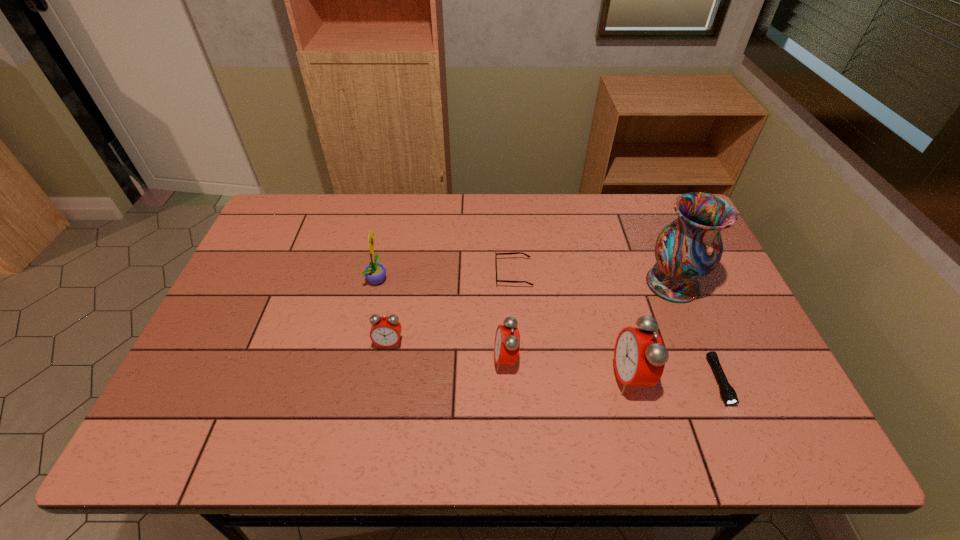
All alarm clocks are currently evenly spaced. To continue this pattern, where would you add another alarm clock on the right? Please point out a vacant spot. Please provide its 2D coordinates. Your answer should be formatted as a tuple, i.e. [(x, y)], where the tuple contains the x and y coordinates of a point satisfying the conditions above.

[(763, 396)]